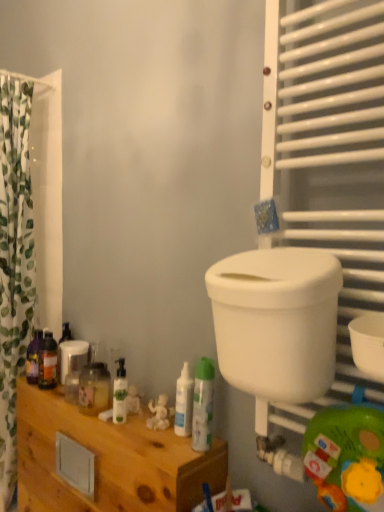
Find the location of a particular element. vacant space in front of white glossy bottle at center, the 2th toiletry viewed from the right is located at coordinates coord(175,449).